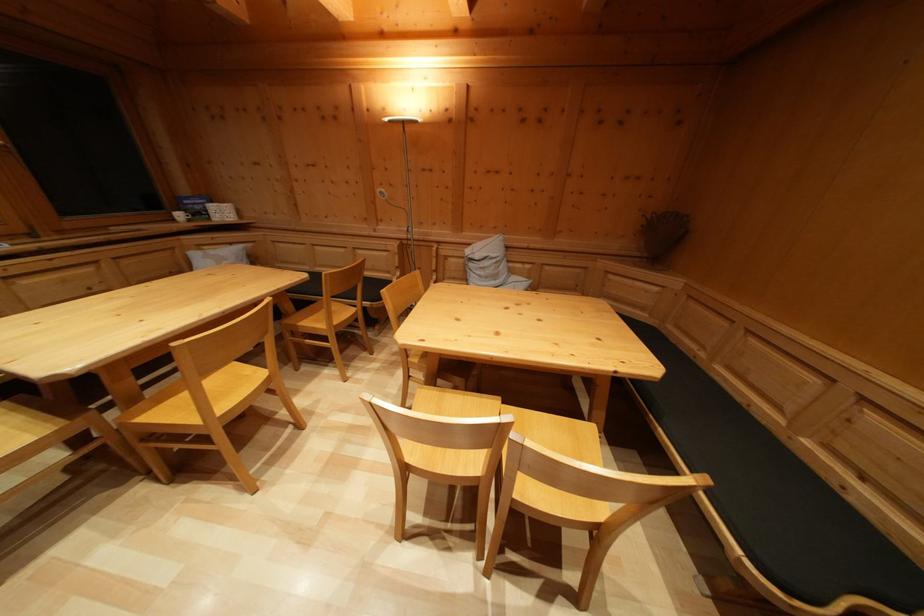
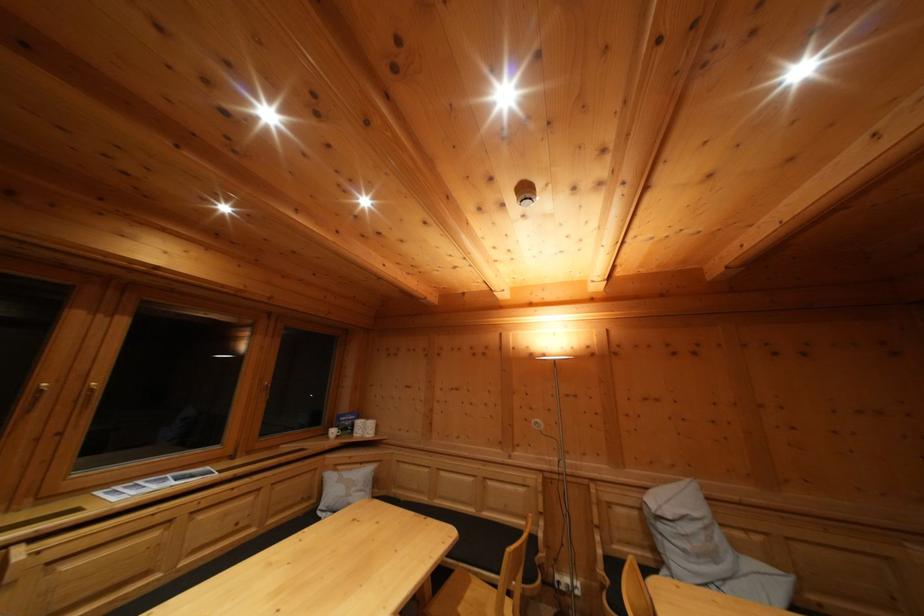
Where in the second image is the point corresponding to the point at 395,280 from the first image?

(532, 525)